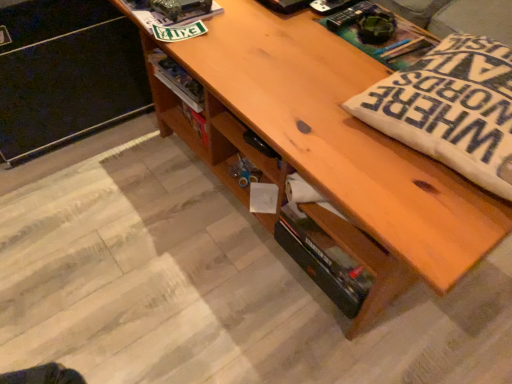
Question: From a real-world perspective, relative to wooden shelf at upper center, is wooden file cabinet at lower left vertically above or below?

Choices:
 (A) above
 (B) below

Answer: (B)

Question: Is wooden file cabinet at lower left wider or thinner than wooden shelf at upper center?

Choices:
 (A) wide
 (B) thin

Answer: (A)

Question: Which object is the farthest from the white fabric pillow at right?

Choices:
 (A) wooden shelf at upper center
 (B) wooden file cabinet at lower left

Answer: (B)

Question: Estimate the real-world distances between objects in this image. Which object is farther from the wooden file cabinet at lower left?

Choices:
 (A) white fabric pillow at right
 (B) wooden shelf at upper center

Answer: (A)